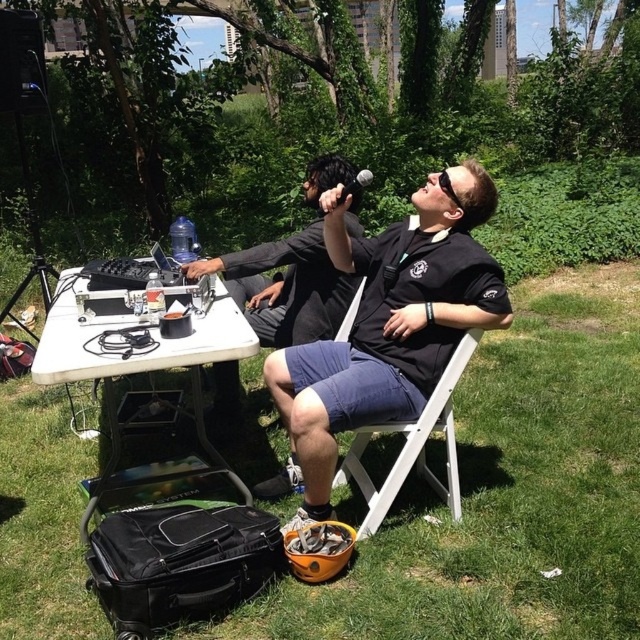
In the scene shown: Is black matte shirt at center to the right of black rubber goggles at upper center from the viewer's perspective?

No, black matte shirt at center is not to the right of black rubber goggles at upper center.

Where is `black matte shirt at center`? The width and height of the screenshot is (640, 640). black matte shirt at center is located at coordinates 387,328.

The width and height of the screenshot is (640, 640). I want to click on black matte shirt at center, so click(387, 328).

Locate an element on the screen. This screenshot has width=640, height=640. black matte shirt at center is located at coordinates (387, 328).

Is point (97, 486) more distant than point (460, 205)?

Yes, point (97, 486) is behind point (460, 205).

Who is more distant from viewer, (179,468) or (440,173)?

A: Positioned behind is point (179,468).

Find the location of a particular element. The image size is (640, 640). white plastic table at center is located at coordinates (138, 358).

Is black matte shirt at center further to the viewer compared to white plastic table at center?

Yes, black matte shirt at center is further from the viewer.

Does black matte shirt at center have a smaller size compared to white plastic table at center?

Yes.

Who is more distant from viewer, (x=392, y=332) or (x=173, y=342)?

Point (x=392, y=332)

The width and height of the screenshot is (640, 640). Find the location of `black matte shirt at center`. black matte shirt at center is located at coordinates (387, 328).